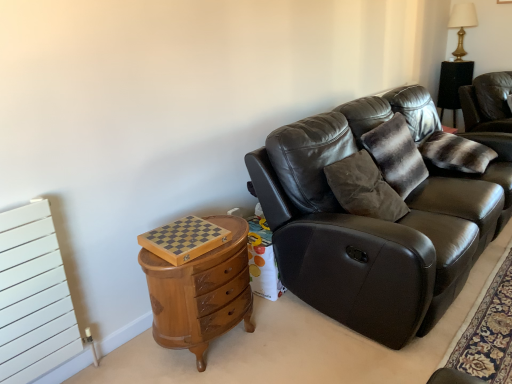
Question: Is gold metallic table lamp at upper right aimed at striped fur pillow at upper right?

Choices:
 (A) no
 (B) yes

Answer: (B)

Question: Is gold metallic table lamp at upper right smaller than striped fur pillow at upper right?

Choices:
 (A) no
 (B) yes

Answer: (A)

Question: Considering the relative sizes of gold metallic table lamp at upper right and striped fur pillow at upper right in the image provided, is gold metallic table lamp at upper right wider than striped fur pillow at upper right?

Choices:
 (A) yes
 (B) no

Answer: (B)

Question: Is gold metallic table lamp at upper right to the right of striped fur pillow at upper right from the viewer's perspective?

Choices:
 (A) no
 (B) yes

Answer: (B)

Question: Is striped fur pillow at upper right located within gold metallic table lamp at upper right?

Choices:
 (A) yes
 (B) no

Answer: (B)

Question: Can you confirm if gold metallic table lamp at upper right is bigger than striped fur pillow at upper right?

Choices:
 (A) no
 (B) yes

Answer: (B)

Question: Is matte black leather couch at center positioned with its back to gold metallic table lamp at upper right?

Choices:
 (A) yes
 (B) no

Answer: (B)

Question: Can you confirm if matte black leather couch at center is wider than gold metallic table lamp at upper right?

Choices:
 (A) no
 (B) yes

Answer: (B)

Question: Considering the relative sizes of matte black leather couch at center and gold metallic table lamp at upper right in the image provided, is matte black leather couch at center taller than gold metallic table lamp at upper right?

Choices:
 (A) yes
 (B) no

Answer: (A)

Question: Is matte black leather couch at center thinner than gold metallic table lamp at upper right?

Choices:
 (A) yes
 (B) no

Answer: (B)

Question: Is matte black leather couch at center not within gold metallic table lamp at upper right?

Choices:
 (A) yes
 (B) no

Answer: (A)

Question: From a real-world perspective, is matte black leather couch at center on top of gold metallic table lamp at upper right?

Choices:
 (A) yes
 (B) no

Answer: (B)

Question: Can you confirm if leather couch at right is smaller than matte black leather couch at center?

Choices:
 (A) no
 (B) yes

Answer: (B)